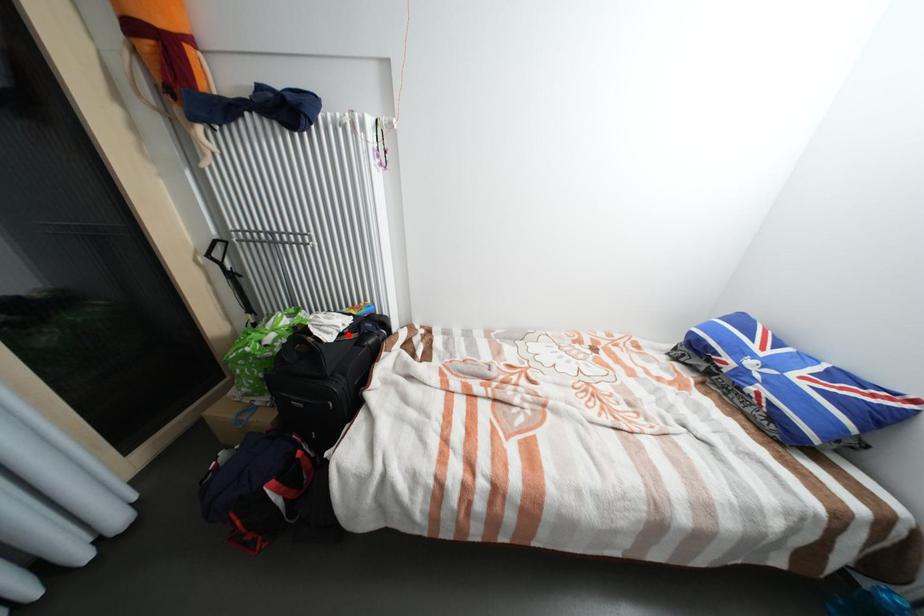
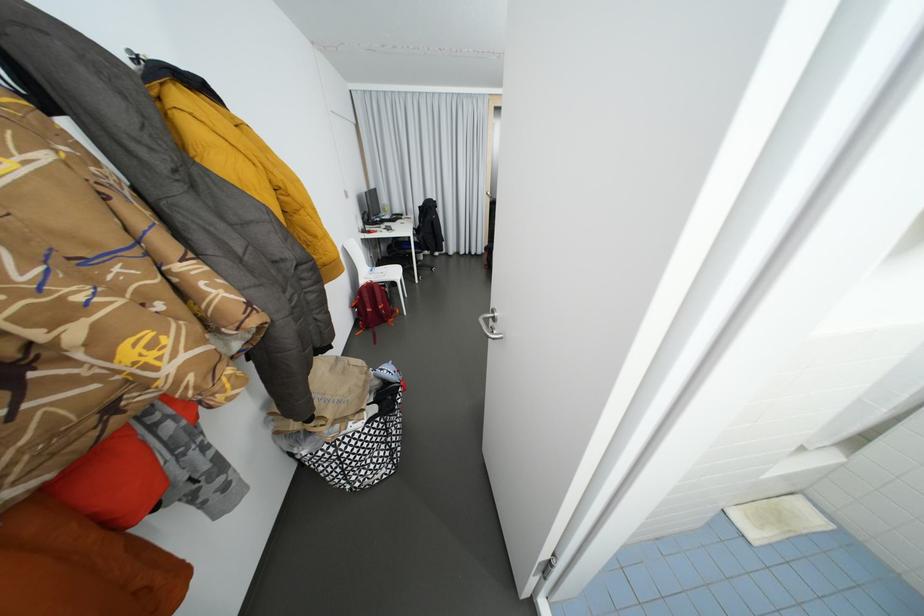
Question: I am providing you with two images of the same scene from different viewpoints. A red point is marked on the first image. Can you still see the location of the red point in image 2?

Choices:
 (A) Yes
 (B) No

Answer: (B)